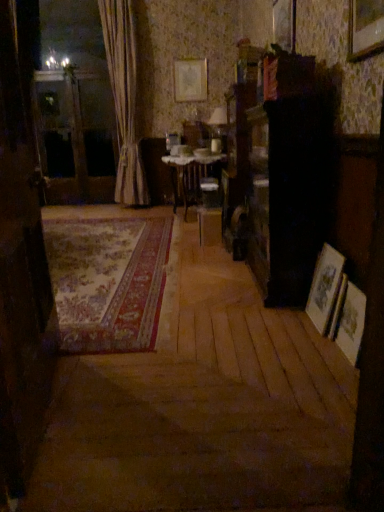
The image size is (384, 512). In order to click on vacant region to the right of transparent glass screen door at left, the first screen door from the front in this screenshot , I will do `click(178, 393)`.